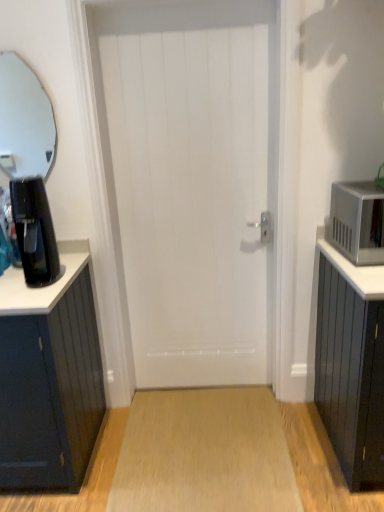
Question: Is light brown wood floor at center taller or shorter than white wooden door at center?

Choices:
 (A) short
 (B) tall

Answer: (A)

Question: From a real-world perspective, is light brown wood floor at center positioned above or below white wooden door at center?

Choices:
 (A) above
 (B) below

Answer: (B)

Question: Estimate the real-world distances between objects in this image. Which object is farther from the black plastic coffee maker at left?

Choices:
 (A) light brown wood floor at center
 (B) satin silver microwave at right
 (C) white wooden door at center
 (D) clear glass mirror at upper left

Answer: (D)

Question: Based on their relative distances, which object is farther from the satin silver microwave at right?

Choices:
 (A) black plastic coffee maker at left
 (B) clear glass mirror at upper left
 (C) white wooden door at center
 (D) light brown wood floor at center

Answer: (B)